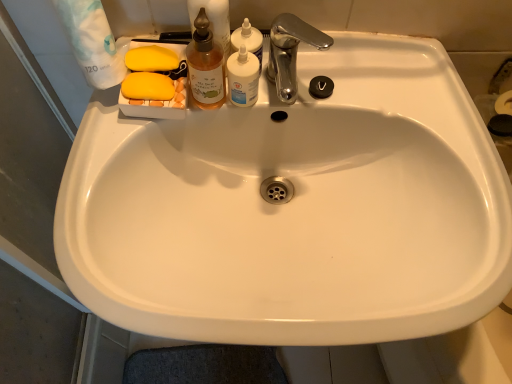
This screenshot has height=384, width=512. Identify the location of vacant space to the right of translucent glass bottle at upper center, which appears as the 1th cleaning product when viewed from the left. (345, 76).